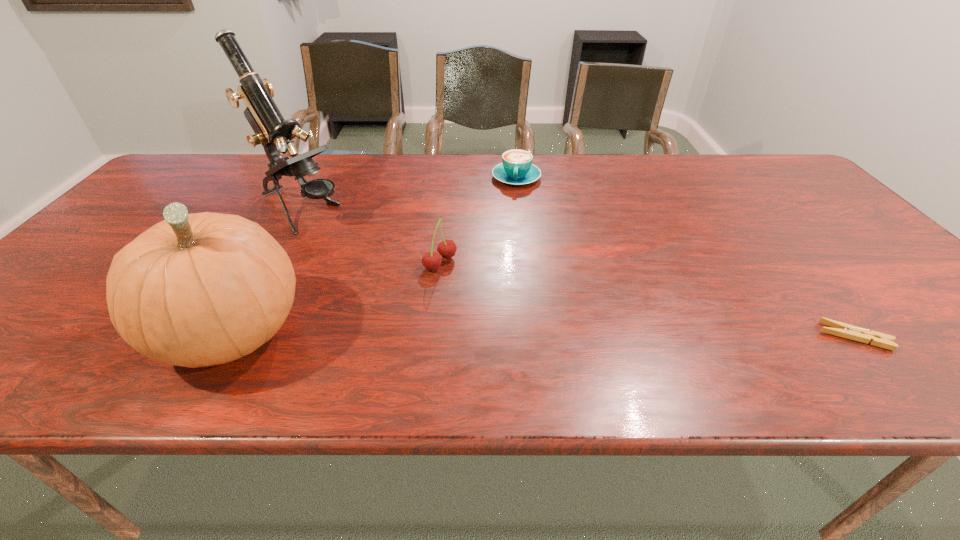
Locate an element on the screen. The image size is (960, 540). vacant position located through the eyepiece of the microscope is located at coordinates (343, 233).

This screenshot has width=960, height=540. I want to click on vacant region located through the eyepiece of the microscope, so click(348, 235).

Find the location of `vacant space located with the handle on the right side of the cappuccino`. vacant space located with the handle on the right side of the cappuccino is located at coordinates click(512, 210).

Identify the location of vacant space located 0.090m with the handle on the right side of the cappuccino. The width and height of the screenshot is (960, 540). (513, 206).

Locate an element on the screen. The height and width of the screenshot is (540, 960). vacant point located 0.080m with the handle on the right side of the cappuccino is located at coordinates (513, 204).

Identify the location of free region located 0.200m on the surface of the third object from right to left. (522, 308).

Where is `blank space located 0.210m on the surface of the third object from right to left`? blank space located 0.210m on the surface of the third object from right to left is located at coordinates (526, 310).

The width and height of the screenshot is (960, 540). Identify the location of vacant space located on the surface of the third object from right to left. (492, 292).

This screenshot has height=540, width=960. Identify the location of microscope at the far edge. (271, 130).

The width and height of the screenshot is (960, 540). In order to click on cappuccino that is positioned at the far edge in this screenshot , I will do `click(516, 168)`.